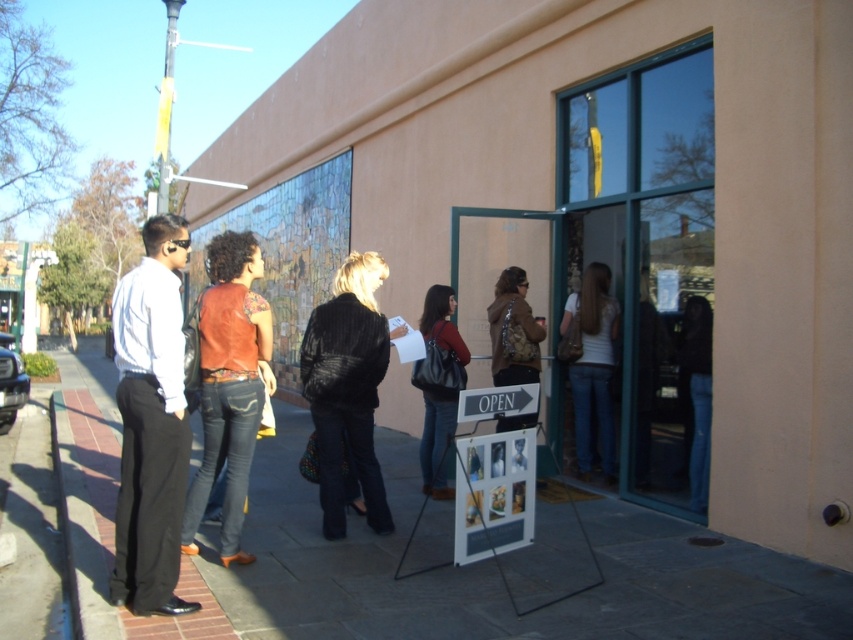
You are standing at the entrance of the gallery and want to take a photo of two specific points in the scene. The first point is labeled as point [141,570] and the second is point [691,410]. Since you want to ensure both points are in focus, which point should you focus on to capture both effectively?

You should focus on point [141,570] because it is closer to the viewer than point [691,410]. By focusing on the closer point, the farther point will still be within the depth of field, ensuring both are in focus.

Looking at this image, you are standing at the entrance of the building and want to place a new poster exactly where the leather jacket at center is currently located. What are the coordinates where you should place the poster?

The coordinates for the leather jacket at center are at point (229,385). You should place the poster at those coordinates.

You are a security guard at the gallery entrance. You notice a leather jacket at center and a matte black purse at center. Which item is positioned higher relative to the other?

The leather jacket at center is located above the matte black purse at center, so it is positioned higher.